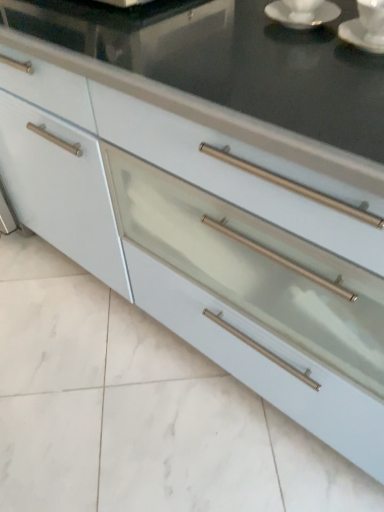
Question: From a real-world perspective, is white ceramic saucer at upper right, which is the second saucer in left-to-right order, beneath white glossy saucer at upper right?

Choices:
 (A) no
 (B) yes

Answer: (A)

Question: Is white glossy saucer at upper right located within white ceramic saucer at upper right, which is the second saucer in left-to-right order?

Choices:
 (A) no
 (B) yes

Answer: (A)

Question: Is white ceramic saucer at upper right, the 1th saucer viewed from the right, bigger than white glossy saucer at upper right?

Choices:
 (A) yes
 (B) no

Answer: (A)

Question: Does white ceramic saucer at upper right, which is the second saucer in left-to-right order, have a lesser width compared to white glossy saucer at upper right?

Choices:
 (A) no
 (B) yes

Answer: (B)

Question: Is white ceramic saucer at upper right, the 1th saucer viewed from the right, outside of white glossy saucer at upper right?

Choices:
 (A) yes
 (B) no

Answer: (A)

Question: In terms of size, does white glossy saucer at upper right, which appears as the second saucer when viewed from the right, appear bigger or smaller than white glossy saucer at upper right?

Choices:
 (A) big
 (B) small

Answer: (A)

Question: Considering their positions, is white glossy saucer at upper right, which is counted as the first saucer, starting from the left, located in front of or behind white glossy saucer at upper right?

Choices:
 (A) behind
 (B) front

Answer: (B)

Question: Considering the positions of point (316, 8) and point (327, 9), is point (316, 8) closer or farther from the camera than point (327, 9)?

Choices:
 (A) farther
 (B) closer

Answer: (A)

Question: Considering the relative positions of white glossy saucer at upper right, which appears as the second saucer when viewed from the right, and white glossy saucer at upper right in the image provided, is white glossy saucer at upper right, which appears as the second saucer when viewed from the right, to the left or to the right of white glossy saucer at upper right?

Choices:
 (A) right
 (B) left

Answer: (A)

Question: From their relative heights in the image, would you say satin white drawer at center is taller or shorter than white glossy saucer at upper right, which appears as the second saucer when viewed from the right?

Choices:
 (A) short
 (B) tall

Answer: (A)

Question: In the image, is satin white drawer at center positioned in front of or behind white glossy saucer at upper right, which is counted as the first saucer, starting from the left?

Choices:
 (A) front
 (B) behind

Answer: (A)

Question: Is satin white drawer at center wider or thinner than white glossy saucer at upper right, which is counted as the first saucer, starting from the left?

Choices:
 (A) thin
 (B) wide

Answer: (B)

Question: Is satin white drawer at center to the left or to the right of white glossy saucer at upper right, which appears as the second saucer when viewed from the right, in the image?

Choices:
 (A) left
 (B) right

Answer: (A)

Question: Is white glossy saucer at upper right taller or shorter than satin white drawer at center?

Choices:
 (A) tall
 (B) short

Answer: (B)

Question: Would you say white glossy saucer at upper right is to the left or to the right of satin white drawer at center in the picture?

Choices:
 (A) right
 (B) left

Answer: (A)